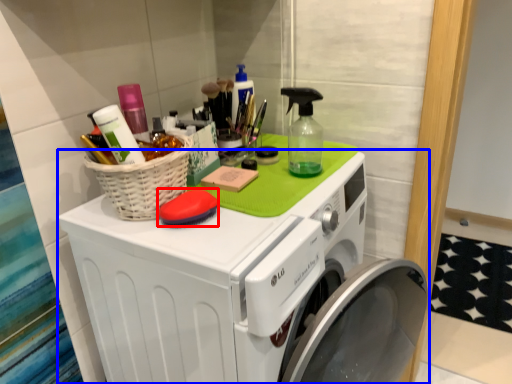
Question: Among these objects, which one is nearest to the camera, soap (highlighted by a red box) or washing machine (highlighted by a blue box)?

Choices:
 (A) soap
 (B) washing machine

Answer: (B)